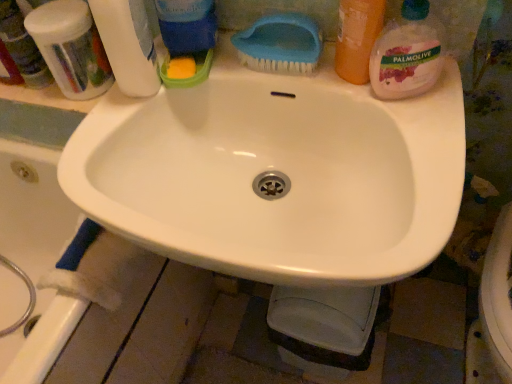
This screenshot has height=384, width=512. Find the location of `vacant area situated to the left side of palmolive liquid soap at upper right, which appears as the first cleaning product when viewed from the right`. vacant area situated to the left side of palmolive liquid soap at upper right, which appears as the first cleaning product when viewed from the right is located at coordinates (312, 86).